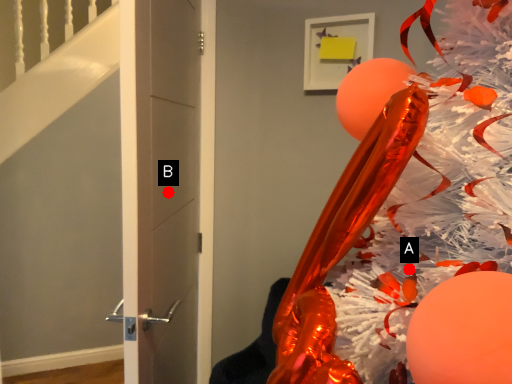
Question: Two points are circled on the image, labeled by A and B beside each circle. Which point is closer to the camera?

Choices:
 (A) A is closer
 (B) B is closer

Answer: (A)